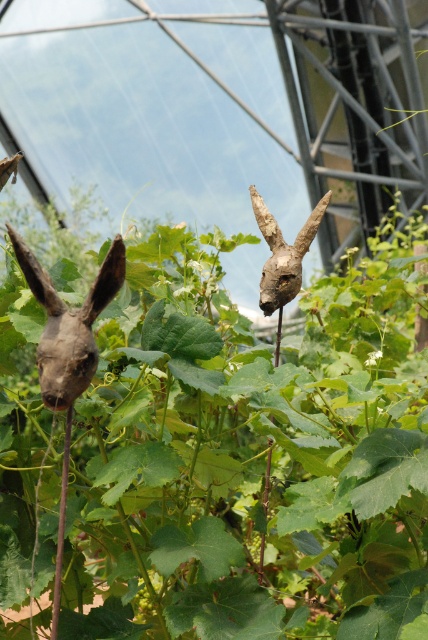
You are standing in the greenhouse and want to place a new sculpture on the green leafy plant at center. Is there enough space on the plant to place the sculpture?

The green leafy plant at center is located at point (216, 451), so yes, there is enough space to place the sculpture on it.

You are an artist planning to place a third wooden rabbit head sculpture between the existing ones. The new sculpture must be taller than the wooden rabbit head at left but shorter than the wooden rabbit head at center. Is this possible?

Yes, it is possible to place a third wooden rabbit head sculpture between them since the wooden rabbit head at left is shorter than the wooden rabbit head at center, allowing for a size in between.

You are a gardener who needs to water the green leafy plant at center and the wooden rabbit head at center. The watering can you have can only reach 10 inches. Can you water both without moving the can?

The green leafy plant at center is 11.91 inches from the wooden rabbit head at center, which is beyond the 10 inch reach of the watering can. Therefore, you cannot water both without moving the can.